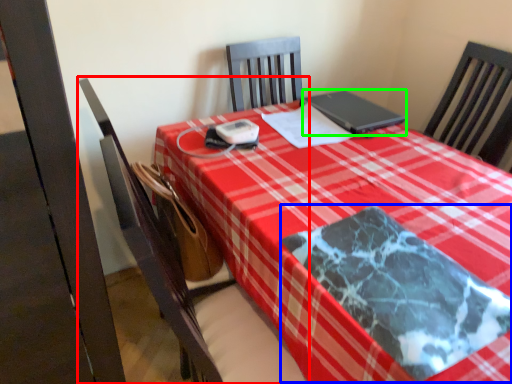
Question: Considering the real-world distances, which object is closest to chair (highlighted by a red box)? blanket (highlighted by a blue box) or laptop (highlighted by a green box).

Choices:
 (A) blanket
 (B) laptop

Answer: (A)